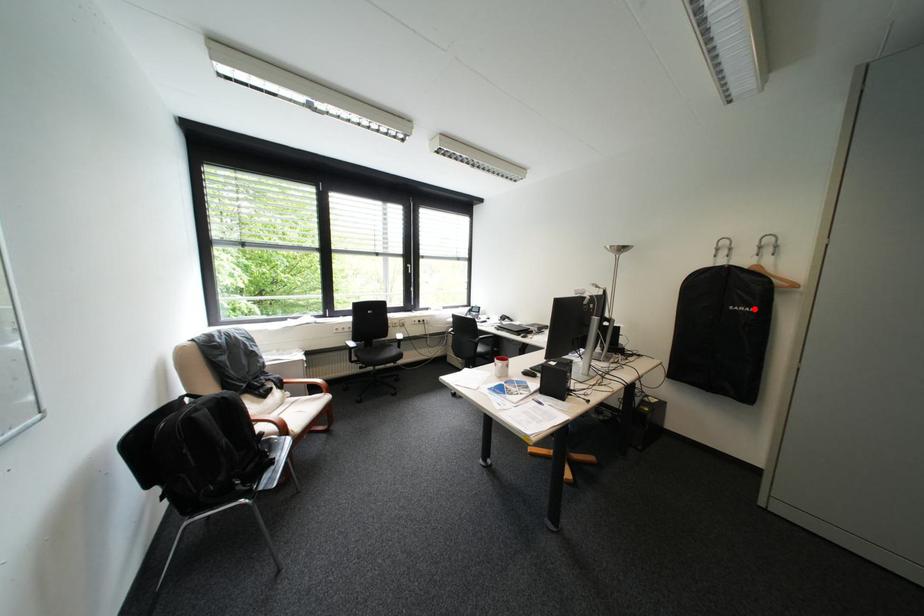
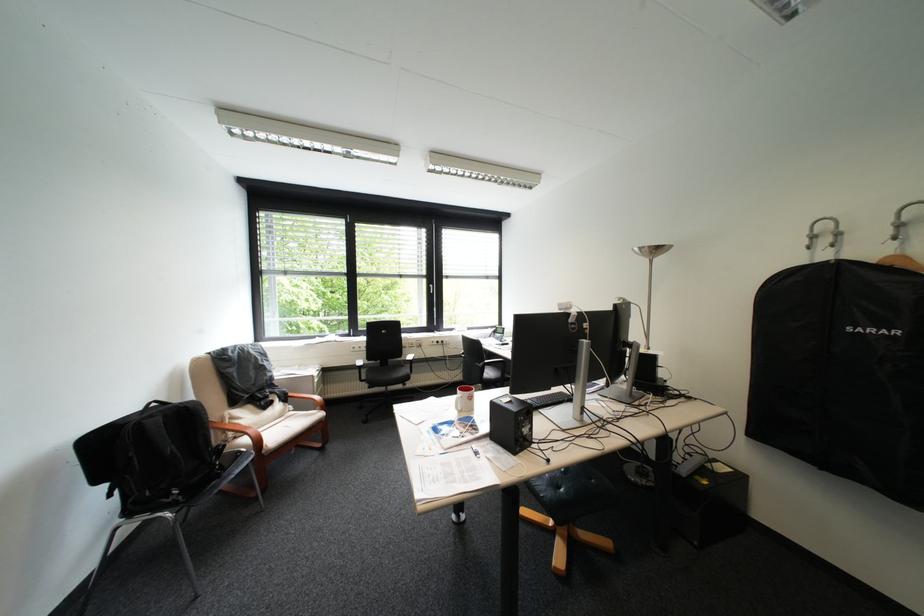
In the second image, find the point that corresponds to the highlighted location in the first image.

(883, 331)